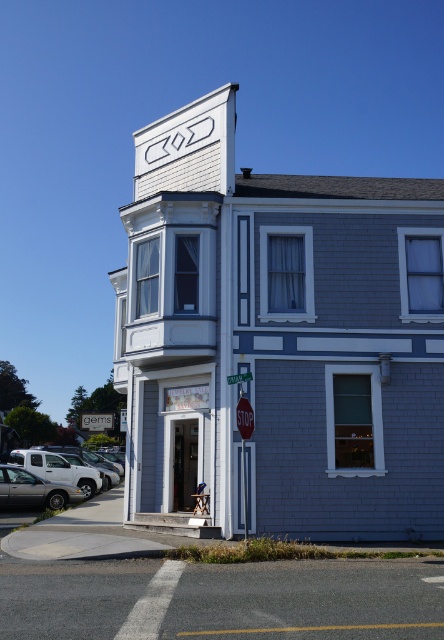
You are standing at the corner of the street where the two story building is located. There is a point marked at coordinates (280, 339) on the image. What does this point indicate?

The point at coordinates (280, 339) marks the gray brick building at center.

You are a delivery person who needs to park your delivery van next to the gray brick building at center. However, there is a silver metallic sedan at lower left already parked there. Can you park your van there without moving the sedan?

The gray brick building at center is bigger than the silver metallic sedan at lower left, but the size of the building does not directly indicate the available parking space. You would need to check if there is enough space between the sedan and other obstacles to park your van without moving the sedan.